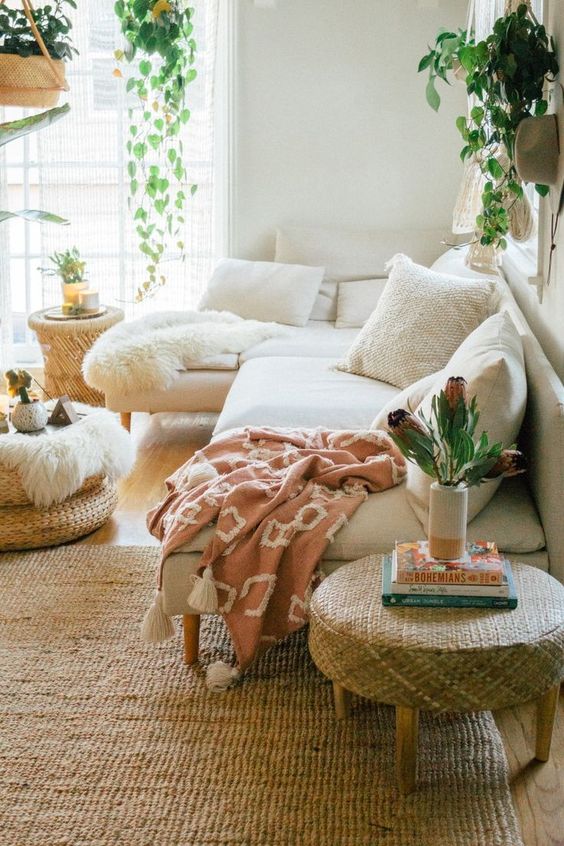
The width and height of the screenshot is (564, 846). In order to click on window in this screenshot , I will do `click(92, 179)`, `click(94, 216)`, `click(95, 37)`.